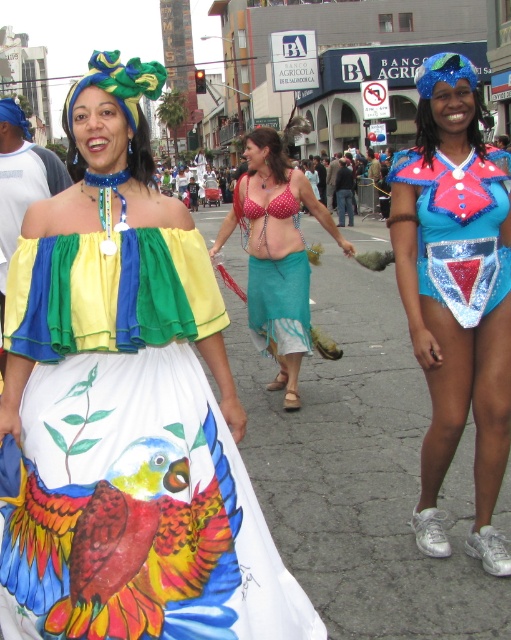
From the picture: Between blue sequined leotard at center and blue sequined top at right, which one appears on the right side from the viewer's perspective?

blue sequined top at right is more to the right.

The image size is (511, 640). What do you see at coordinates (455, 294) in the screenshot?
I see `blue sequined leotard at center` at bounding box center [455, 294].

Find the location of a particular element. blue sequined leotard at center is located at coordinates (455, 294).

Does painted cotton skirt at center appear on the left side of polka dot fabric bikini top at center?

Correct, you'll find painted cotton skirt at center to the left of polka dot fabric bikini top at center.

Between painted cotton skirt at center and polka dot fabric bikini top at center, which one appears on the left side from the viewer's perspective?

Positioned to the left is painted cotton skirt at center.

This screenshot has width=511, height=640. In order to click on painted cotton skirt at center in this screenshot , I will do `click(129, 456)`.

Between painted cotton skirt at center and blue sequined leotard at center, which one appears on the right side from the viewer's perspective?

Positioned to the right is blue sequined leotard at center.

Can you confirm if painted cotton skirt at center is taller than blue sequined leotard at center?

No, painted cotton skirt at center is not taller than blue sequined leotard at center.

Is point (256, 589) positioned before point (483, 260)?

Yes, point (256, 589) is in front of point (483, 260).

Find the location of a particular element. painted cotton skirt at center is located at coordinates (129, 456).